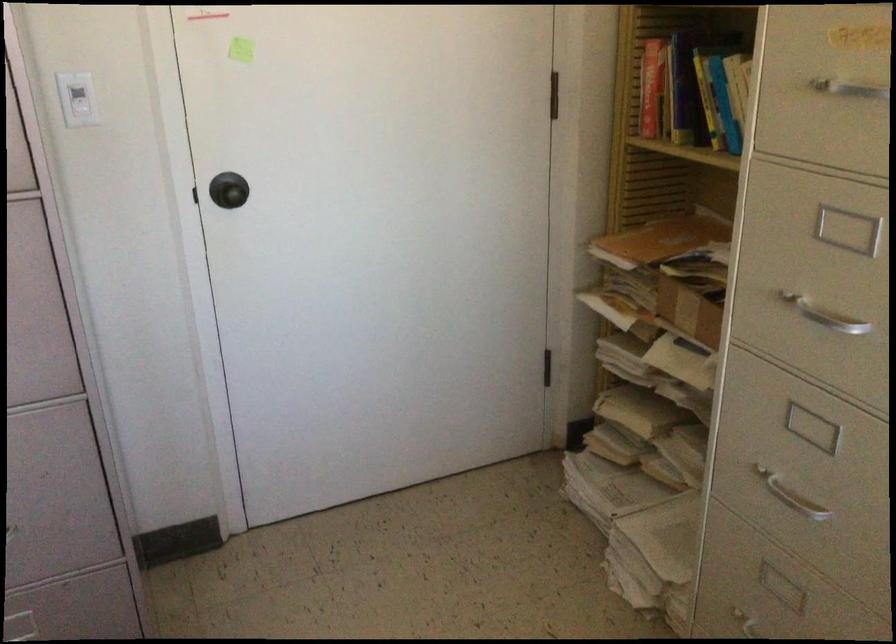
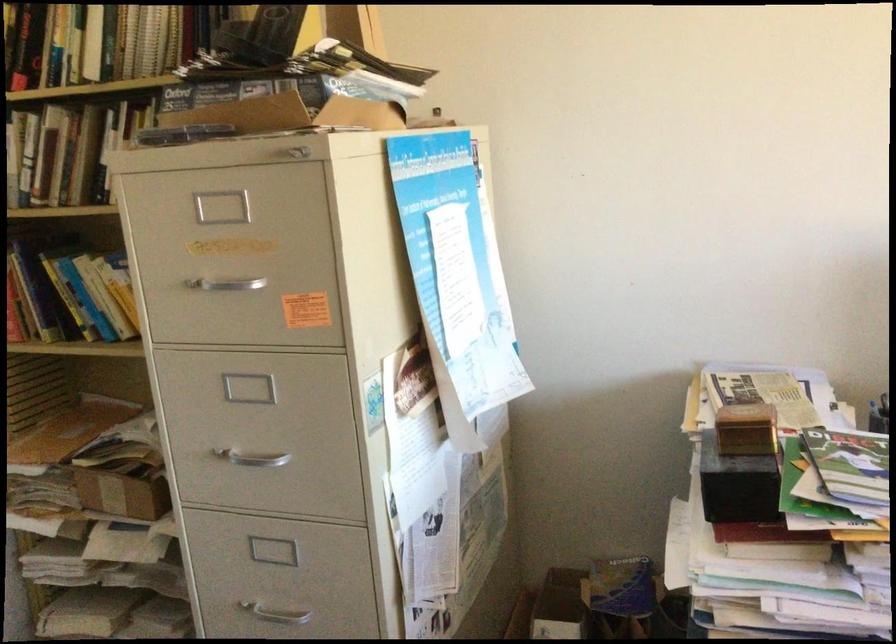
Locate, in the second image, the point that corresponds to pixel 782 491 in the first image.

(273, 608)